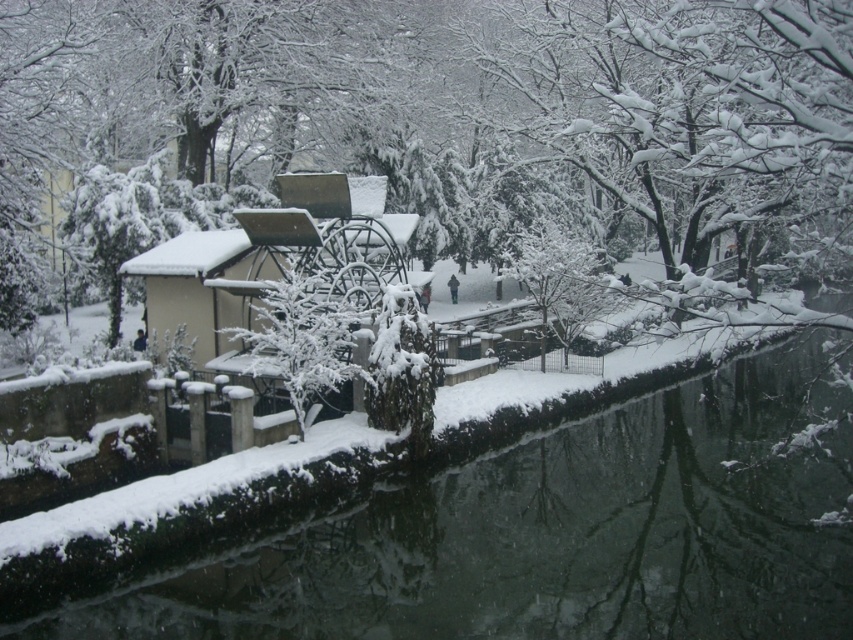
Question: Which point is closer to the camera?

Choices:
 (A) (370, 516)
 (B) (167, 288)

Answer: (A)

Question: Is snowy concrete river at lower left above white matte watermill at center?

Choices:
 (A) no
 (B) yes

Answer: (A)

Question: Is snowy concrete river at lower left positioned before white matte watermill at center?

Choices:
 (A) yes
 (B) no

Answer: (A)

Question: Observing the image, what is the correct spatial positioning of snowy concrete river at lower left in reference to white matte watermill at center?

Choices:
 (A) above
 (B) below

Answer: (B)

Question: Among these objects, which one is farthest from the camera?

Choices:
 (A) snowy concrete river at lower left
 (B) white matte watermill at center

Answer: (B)